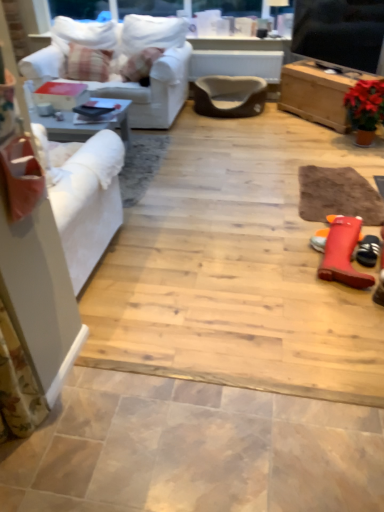
Question: Does rubber boot at lower right, the 2th footwear positioned from the right, have a lesser width compared to brown suede armchair at center?

Choices:
 (A) no
 (B) yes

Answer: (B)

Question: Considering the relative positions of rubber boot at lower right, the 1th footwear when ordered from left to right, and brown suede armchair at center in the image provided, is rubber boot at lower right, the 1th footwear when ordered from left to right, to the left of brown suede armchair at center from the viewer's perspective?

Choices:
 (A) no
 (B) yes

Answer: (A)

Question: From the image's perspective, is rubber boot at lower right, the 2th footwear positioned from the right, above brown suede armchair at center?

Choices:
 (A) no
 (B) yes

Answer: (A)

Question: From the image's perspective, is rubber boot at lower right, the 2th footwear positioned from the right, below brown suede armchair at center?

Choices:
 (A) no
 (B) yes

Answer: (B)

Question: Can brown suede armchair at center be found inside rubber boot at lower right, the 1th footwear when ordered from left to right?

Choices:
 (A) no
 (B) yes

Answer: (A)

Question: Can you confirm if rubber boot at lower right, the 2th footwear positioned from the right, is wider than brown suede armchair at center?

Choices:
 (A) no
 (B) yes

Answer: (A)

Question: Is plaid fabric pillow at upper left facing away from rubber black shoe at lower right, marked as the second footwear in a left-to-right arrangement?

Choices:
 (A) yes
 (B) no

Answer: (B)

Question: Does plaid fabric pillow at upper left have a greater height compared to rubber black shoe at lower right, the first footwear viewed from the right?

Choices:
 (A) yes
 (B) no

Answer: (A)

Question: Considering the relative sizes of plaid fabric pillow at upper left and rubber black shoe at lower right, the first footwear viewed from the right, in the image provided, is plaid fabric pillow at upper left bigger than rubber black shoe at lower right, the first footwear viewed from the right,?

Choices:
 (A) no
 (B) yes

Answer: (B)

Question: Considering the relative sizes of plaid fabric pillow at upper left and rubber black shoe at lower right, marked as the second footwear in a left-to-right arrangement, in the image provided, is plaid fabric pillow at upper left thinner than rubber black shoe at lower right, marked as the second footwear in a left-to-right arrangement,?

Choices:
 (A) yes
 (B) no

Answer: (B)

Question: Considering the relative positions of plaid fabric pillow at upper left and rubber black shoe at lower right, marked as the second footwear in a left-to-right arrangement, in the image provided, is plaid fabric pillow at upper left to the right of rubber black shoe at lower right, marked as the second footwear in a left-to-right arrangement, from the viewer's perspective?

Choices:
 (A) no
 (B) yes

Answer: (A)

Question: Is plaid fabric pillow at upper left at the left side of rubber black shoe at lower right, marked as the second footwear in a left-to-right arrangement?

Choices:
 (A) no
 (B) yes

Answer: (B)

Question: Is matte ceramic tile at lower center, acting as the second ceramic tile starting from the top, at the right side of plaid fabric pillow at upper left?

Choices:
 (A) yes
 (B) no

Answer: (A)